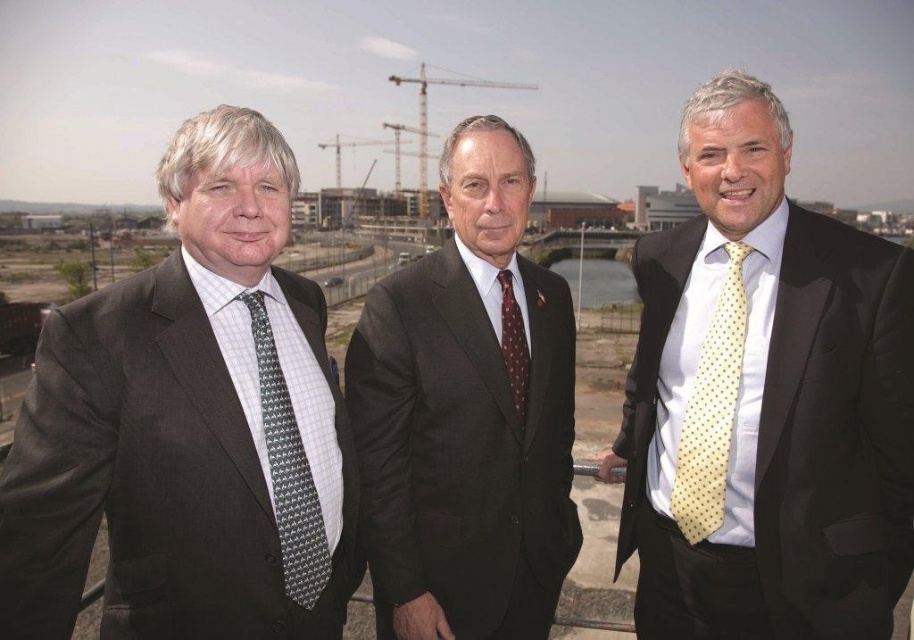
You are a photographer taking a picture of the two men with their ties. The gray printed tie at left and the yellow dotted tie at right are partially overlapping. Which tie is closer to the camera?

The yellow dotted tie at right is closer to the camera because the gray printed tie at left is behind it.

You are a photographer setting up for a group photo. You notice the gray printed tie at left and the maroon dotted tie at center. Which tie should you focus on to ensure it appears larger in the photo?

The gray printed tie at left should be focused on because it is larger in size than the maroon dotted tie at center, making it more prominent in the photo.